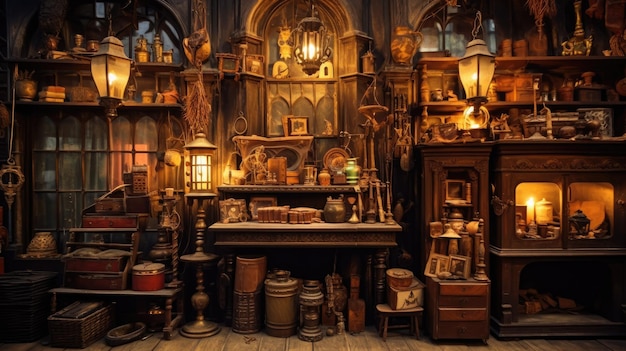
The image size is (626, 351). I want to click on clock, so [x=277, y=74].